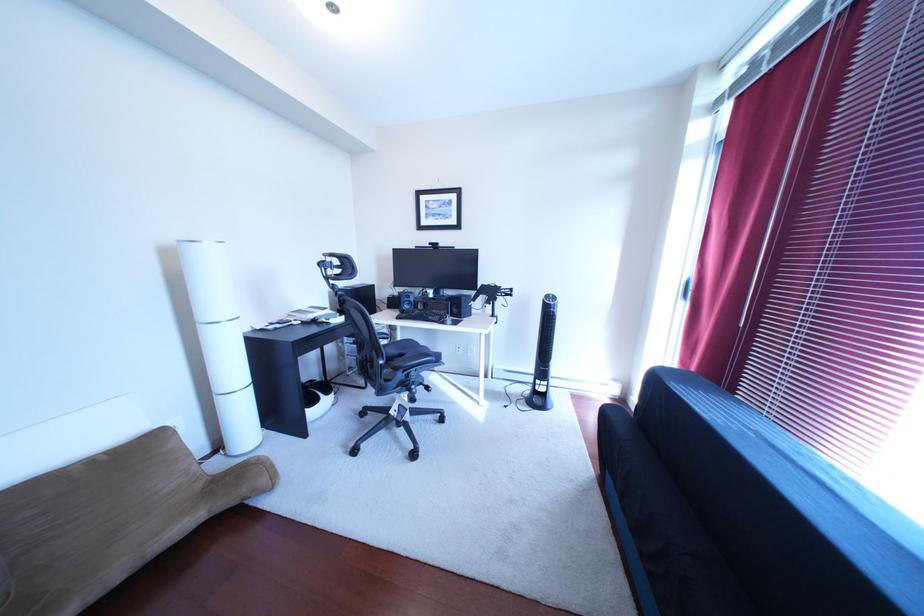
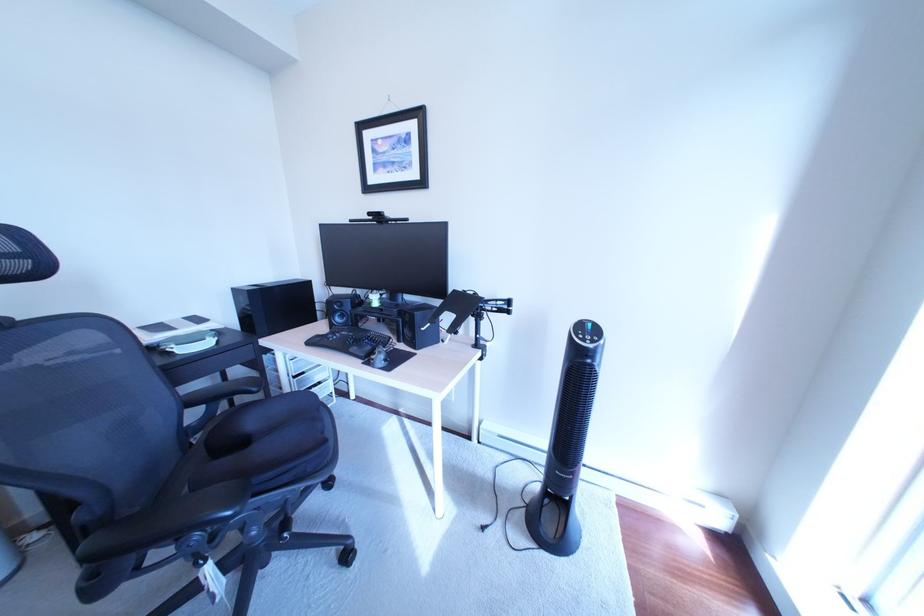
Consider the image. The images are taken continuously from a first-person perspective. In which direction are you moving?

The cameraman walked toward right, forward.